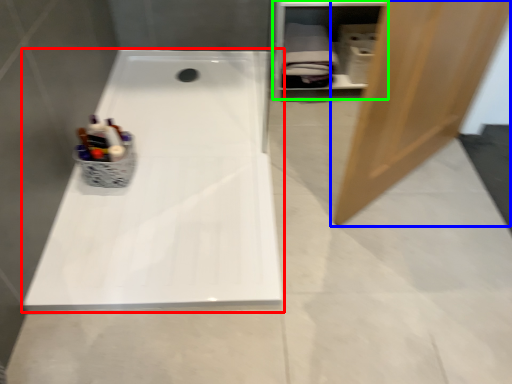
Question: Which object is the farthest from bathtub (highlighted by a red box)? Choose among these: door (highlighted by a blue box) or shelf (highlighted by a green box).

Choices:
 (A) door
 (B) shelf

Answer: (B)